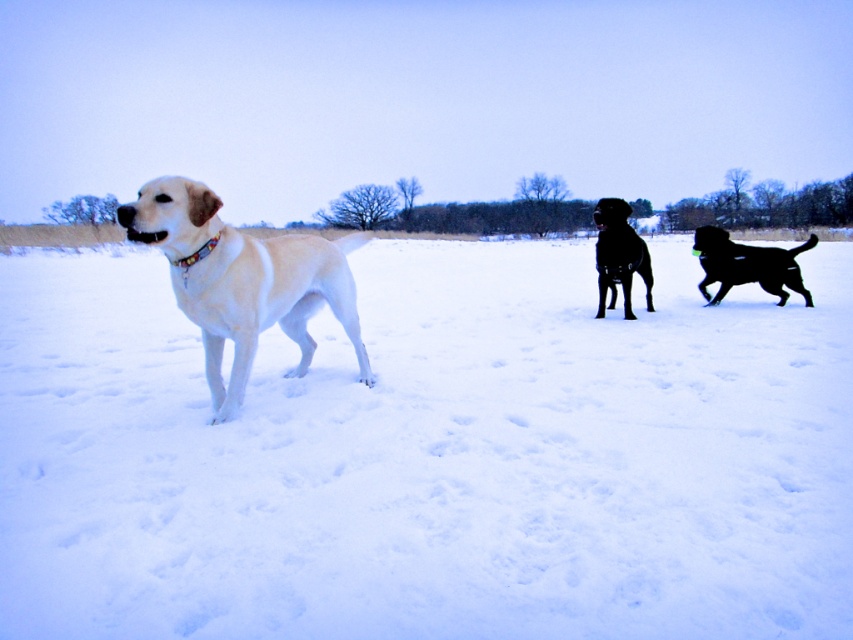
In the winter scene, there are two dogs visible. The shiny golden retriever at left and the shiny black dog at right. Which dog is positioned more to the left side of the image?

The shiny golden retriever at left is positioned more to the left side of the image than the shiny black dog at right.